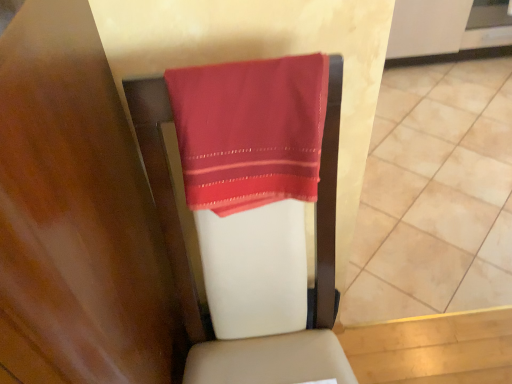
Question: Should I look upward or downward to see satin red towel at center?

Choices:
 (A) up
 (B) down

Answer: (A)

Question: Is matte red towel at center positioned in front of satin red towel at center?

Choices:
 (A) yes
 (B) no

Answer: (B)

Question: Is matte red towel at center at the right side of satin red towel at center?

Choices:
 (A) yes
 (B) no

Answer: (A)

Question: Are matte red towel at center and satin red towel at center beside each other?

Choices:
 (A) yes
 (B) no

Answer: (B)

Question: Is matte red towel at center looking in the opposite direction of satin red towel at center?

Choices:
 (A) no
 (B) yes

Answer: (A)

Question: Does matte red towel at center lie behind satin red towel at center?

Choices:
 (A) yes
 (B) no

Answer: (A)

Question: From a real-world perspective, is matte red towel at center located higher than satin red towel at center?

Choices:
 (A) no
 (B) yes

Answer: (A)

Question: From a real-world perspective, is satin red towel at center positioned over matte red towel at center based on gravity?

Choices:
 (A) no
 (B) yes

Answer: (B)

Question: Can you confirm if satin red towel at center is bigger than matte red towel at center?

Choices:
 (A) yes
 (B) no

Answer: (B)

Question: From the image's perspective, is satin red towel at center above matte red towel at center?

Choices:
 (A) yes
 (B) no

Answer: (B)

Question: Considering the relative positions of satin red towel at center and matte red towel at center in the image provided, is satin red towel at center behind matte red towel at center?

Choices:
 (A) no
 (B) yes

Answer: (A)

Question: Does satin red towel at center appear on the left side of matte red towel at center?

Choices:
 (A) no
 (B) yes

Answer: (B)

Question: Could you tell me if satin red towel at center is turned towards matte red towel at center?

Choices:
 (A) yes
 (B) no

Answer: (B)

Question: Is matte red towel at center spatially inside satin red towel at center, or outside of it?

Choices:
 (A) outside
 (B) inside

Answer: (A)